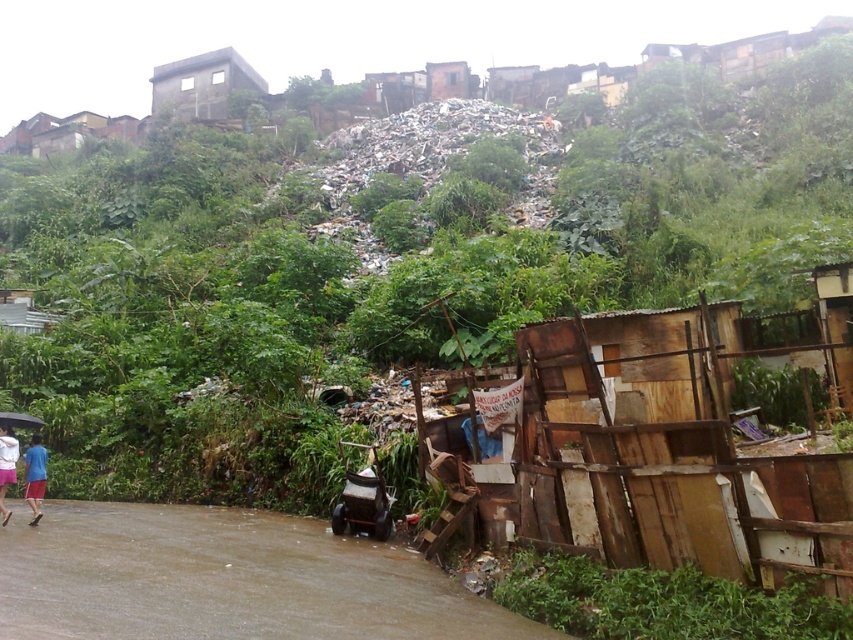
You are a city planner assessing the urban space. You need to determine if the gray concrete building at upper center can be expanded horizontally without encroaching on the blue fabric shorts at lower left. Based on their widths, can the building be expanded to match the shorts in width?

The gray concrete building at upper center is wider than the blue fabric shorts at lower left, so expanding it further would make it even wider than the shorts. Therefore, it cannot be expanded to match the shorts in width without encroaching.

You are a delivery person trying to navigate through the brown muddy flood at lower left and the gray concrete building at upper center. Which path has a narrower width for your vehicle?

The brown muddy flood at lower left has a lesser width compared to the gray concrete building at upper center, so the path through the brown muddy flood at lower left is narrower and may not be suitable for your vehicle.